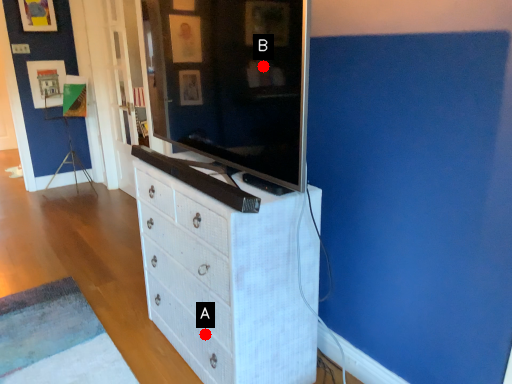
Question: Two points are circled on the image, labeled by A and B beside each circle. Which point appears farthest from the camera in this image?

Choices:
 (A) A is further
 (B) B is further

Answer: (A)